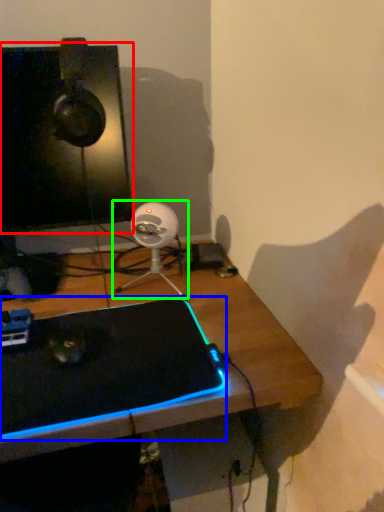
Question: Which object is the farthest from computer monitor (highlighted by a red box)? Choose among these: laptop (highlighted by a blue box) or fan (highlighted by a green box).

Choices:
 (A) laptop
 (B) fan

Answer: (A)